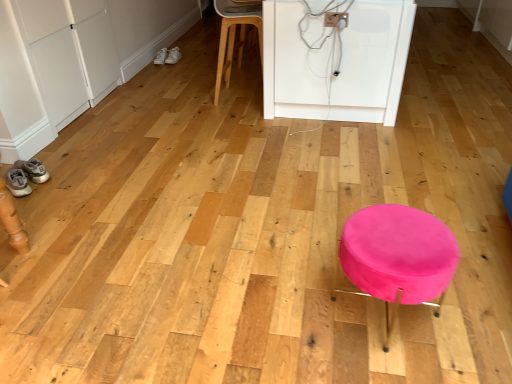
Locate an element on the screen. free space above pink velvet stool at center (from a real-world perspective) is located at coordinates (399, 237).